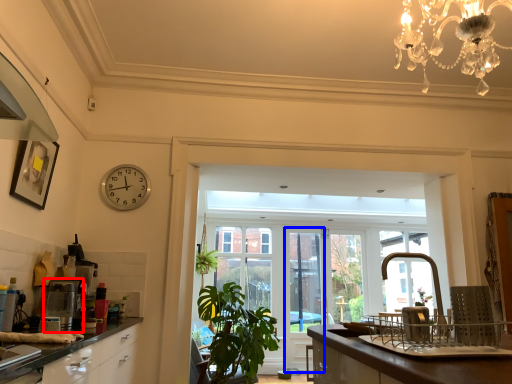
Question: Which object appears closest to the camera in this image, coffee machine (highlighted by a red box) or screen door (highlighted by a blue box)?

Choices:
 (A) coffee machine
 (B) screen door

Answer: (A)